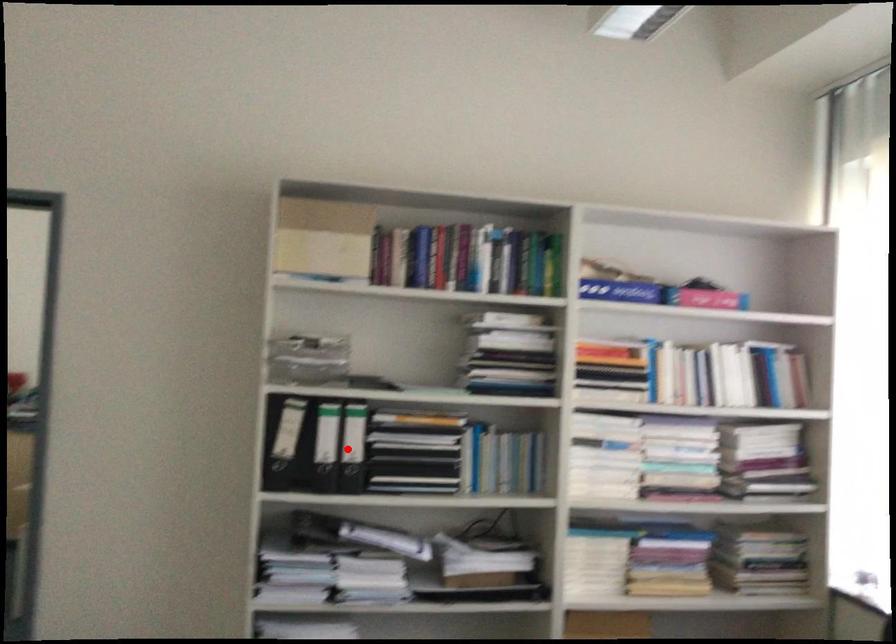
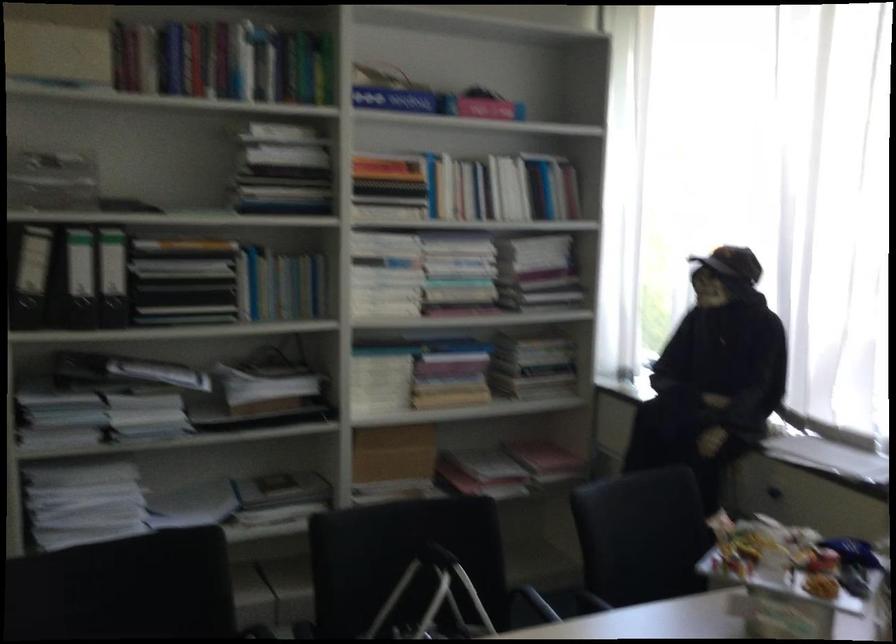
Locate, in the second image, the point that corresponds to the highlighted location in the first image.

(113, 277)